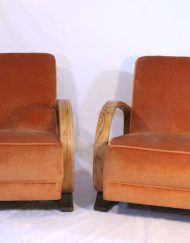
Locate an element on the screen. shadows cast on wall from chairs is located at coordinates (125, 88), (68, 87), (80, 131).